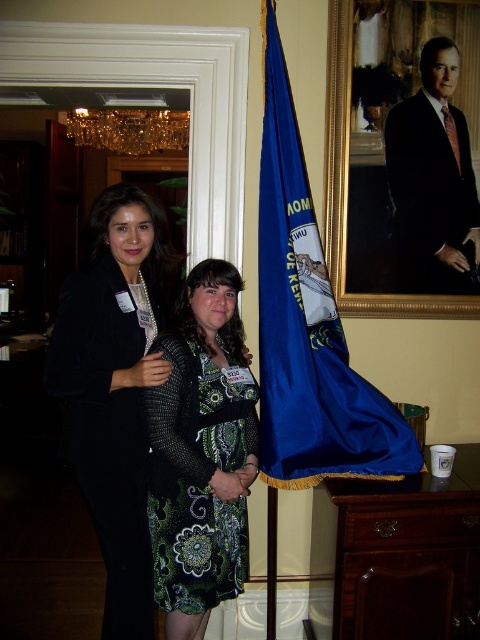
Question: In this image, where is blue fabric flag at center located relative to formal black suit at upper right?

Choices:
 (A) left
 (B) right

Answer: (A)

Question: Based on their relative distances, which object is nearer to the black textured blazer at center?

Choices:
 (A) blue fabric flag at center
 (B) green paisley dress at center
 (C) formal black suit at upper right

Answer: (B)

Question: Which of these objects is positioned farthest from the black textured blazer at center?

Choices:
 (A) formal black suit at upper right
 (B) green paisley dress at center
 (C) blue fabric flag at center

Answer: (A)

Question: Is black textured blazer at center closer to camera compared to formal black suit at upper right?

Choices:
 (A) no
 (B) yes

Answer: (B)

Question: Does black textured blazer at center appear on the right side of blue fabric flag at center?

Choices:
 (A) yes
 (B) no

Answer: (B)

Question: Based on their relative distances, which object is farther from the formal black suit at upper right?

Choices:
 (A) green paisley dress at center
 (B) blue fabric flag at center

Answer: (A)